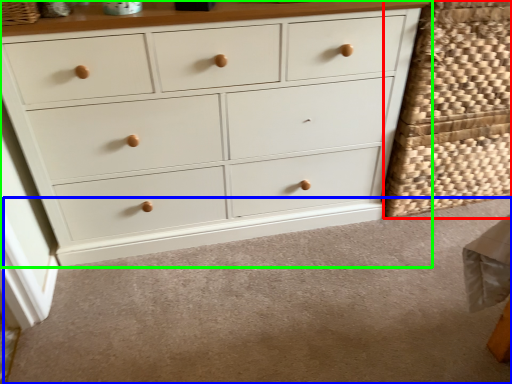
Question: Based on their relative distances, which object is nearer to basket (highlighted by a red box)? Choose from plain (highlighted by a blue box) and chest of drawers (highlighted by a green box).

Choices:
 (A) plain
 (B) chest of drawers

Answer: (B)